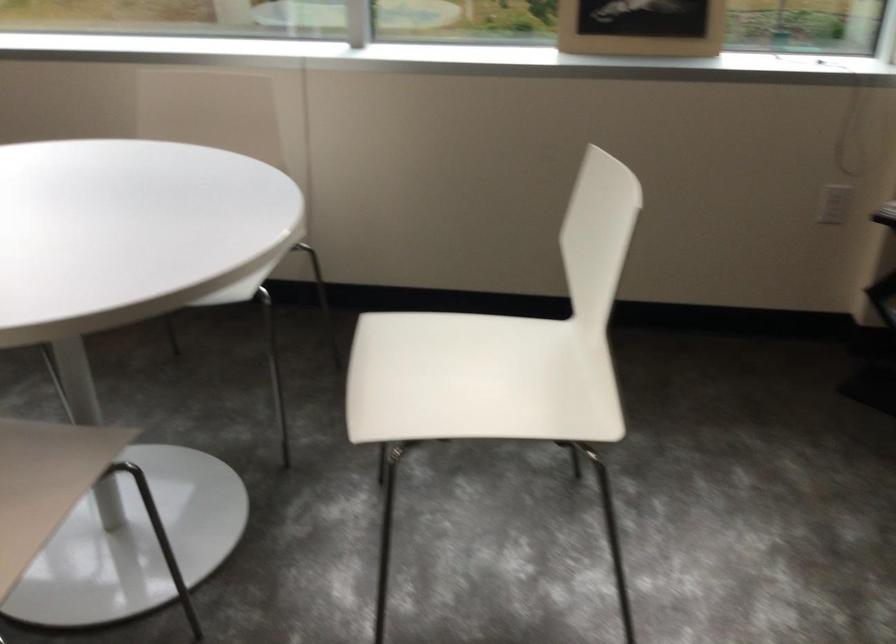
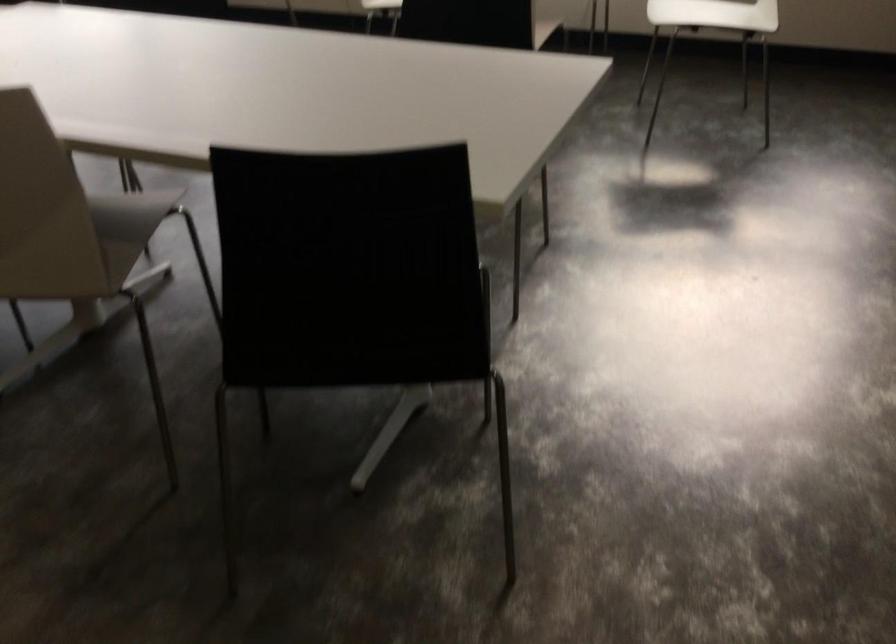
Locate, in the second image, the point that corresponds to (x=504, y=386) in the first image.

(714, 14)